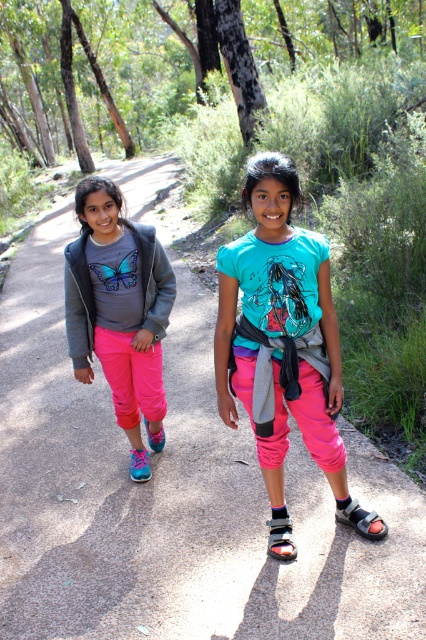
Question: Can you confirm if black leather sandal at lower right is wider than blue suede sandal at lower left?

Choices:
 (A) yes
 (B) no

Answer: (A)

Question: Is the position of teal matte t-shirt at center less distant than that of black leather sandal at lower center?

Choices:
 (A) no
 (B) yes

Answer: (B)

Question: Which of the following is the closest to the observer?

Choices:
 (A) black leather sandal at lower center
 (B) matte gray jacket at center
 (C) pink fabric sandal at center

Answer: (A)

Question: Where is teal matte t-shirt at center located in relation to pink fabric sandal at center in the image?

Choices:
 (A) right
 (B) left

Answer: (A)

Question: Among these points, which one is farthest from the camera?

Choices:
 (A) (141, 454)
 (B) (131, 316)
 (C) (331, 452)

Answer: (A)

Question: Estimate the real-world distances between objects in this image. Which object is closer to the black leather sandal at lower center?

Choices:
 (A) teal matte t-shirt at center
 (B) black leather sandal at lower right

Answer: (B)